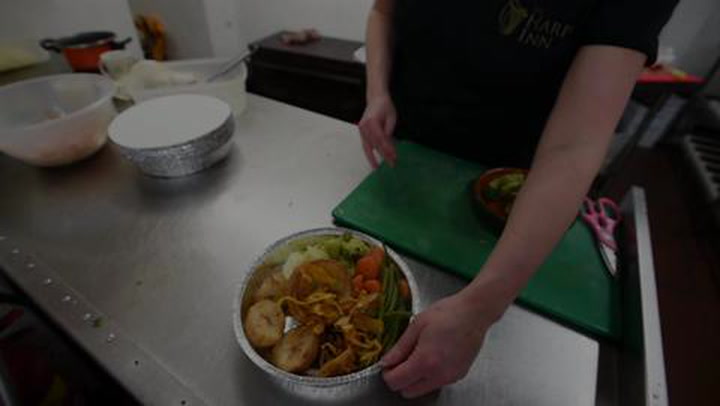
In order to click on steel prep table in kitchen in this screenshot , I will do `click(155, 271)`.